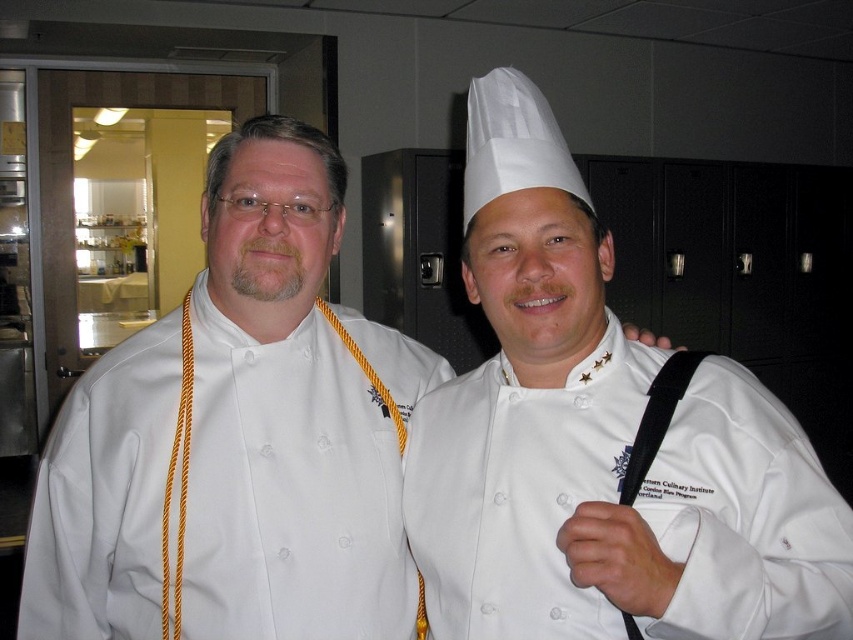
Which of these two, white matte chef hat at upper center or white chef coat at center, stands shorter?

With less height is white matte chef hat at upper center.

Does point (792, 484) come closer to viewer compared to point (236, 605)?

Yes.

The height and width of the screenshot is (640, 853). Find the location of `white matte chef hat at upper center`. white matte chef hat at upper center is located at coordinates (599, 442).